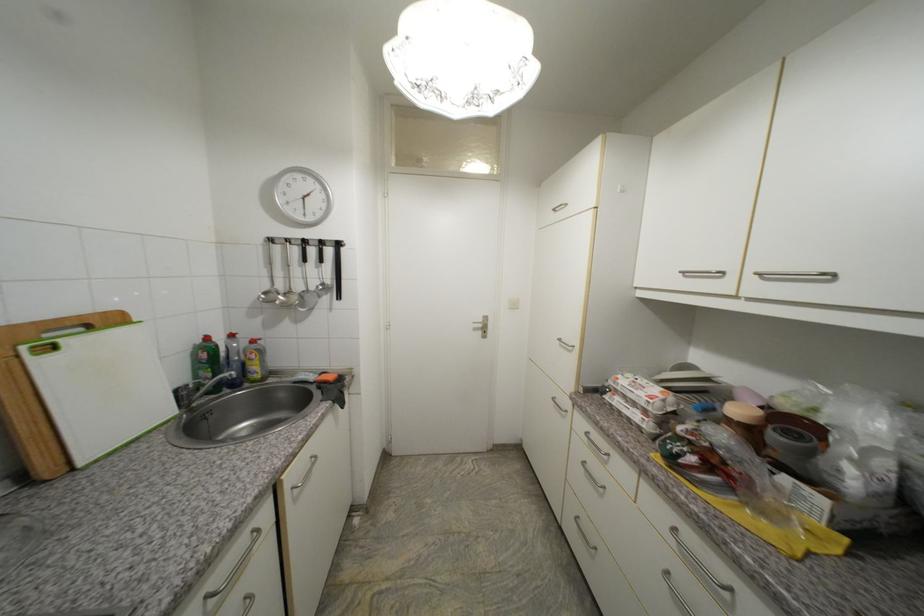
Locate an element on the screen. white light switch is located at coordinates (513, 302).